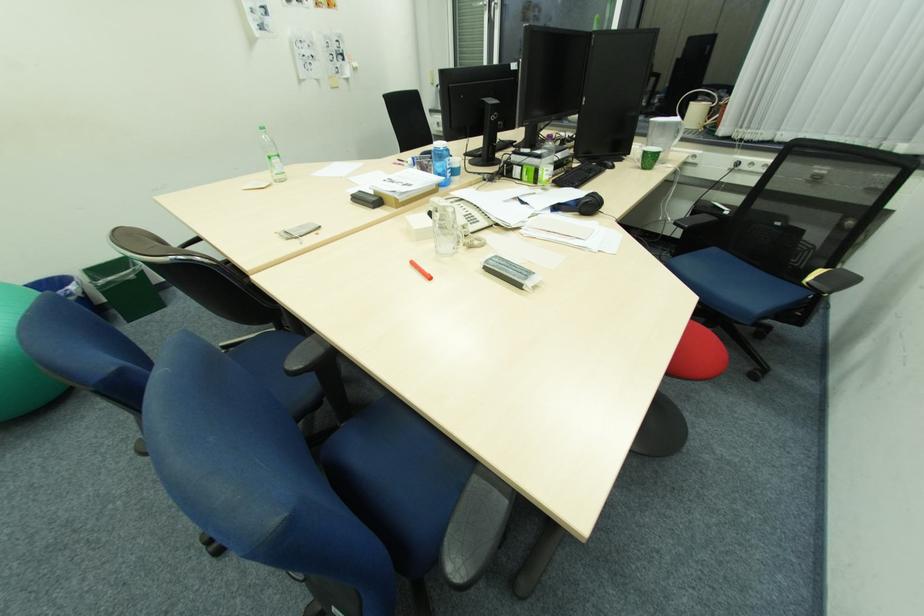
Find where to lift the green plastic cup. Please return your answer as a coordinate pair (x, y).

(649, 156)